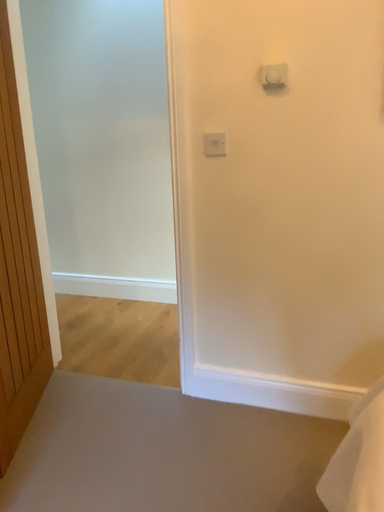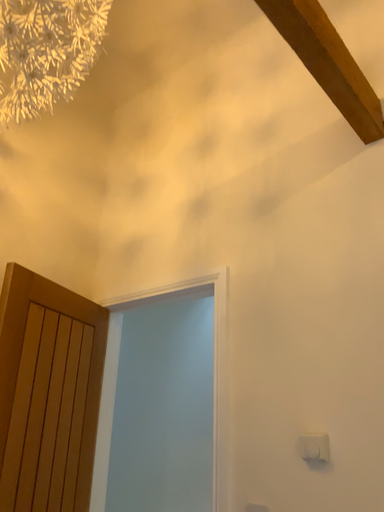
Question: How did the camera likely rotate when shooting the video?

Choices:
 (A) rotated downward
 (B) rotated upward

Answer: (B)